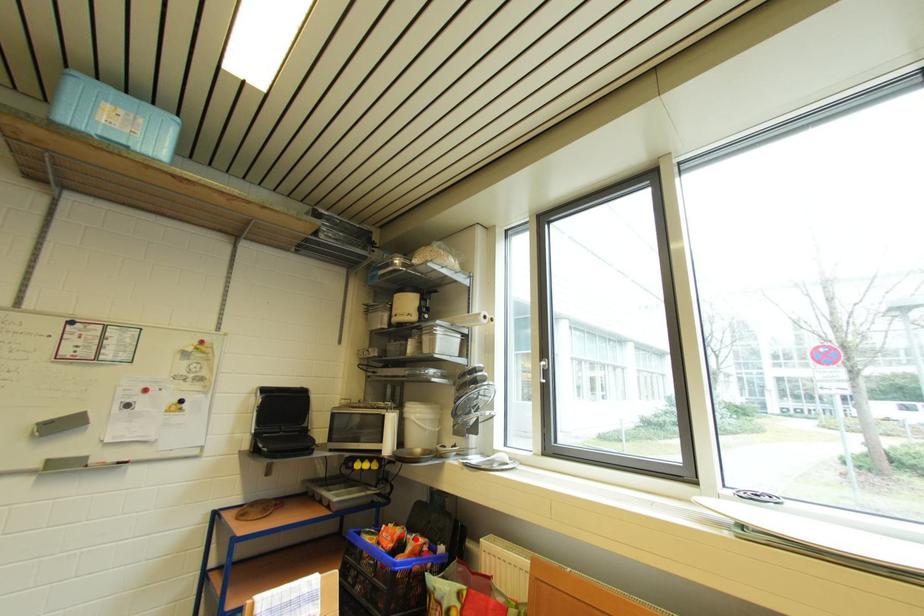
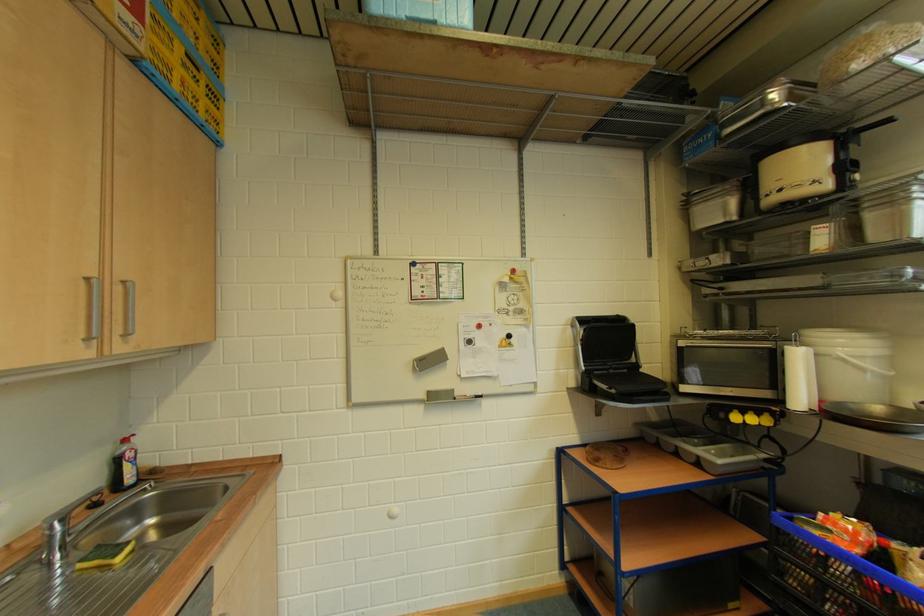
Question: I am providing you with two images of the same scene from different viewpoints. A red point is shown in image1. For the corresponding object point in image2, is it positioned nearer or farther from the camera?

Choices:
 (A) Nearer
 (B) Farther

Answer: (A)